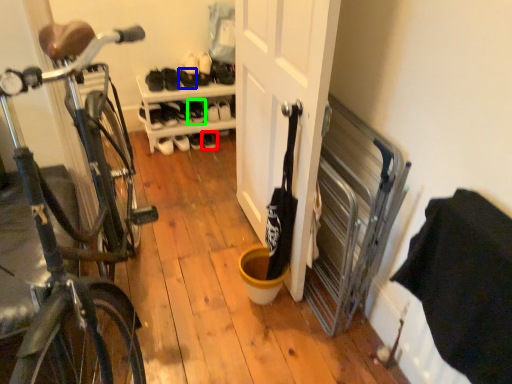
Question: Which object is positioned closest to footwear (highlighted by a red box)? Select from shoe (highlighted by a blue box) and shoe (highlighted by a green box).

Choices:
 (A) shoe
 (B) shoe

Answer: (B)